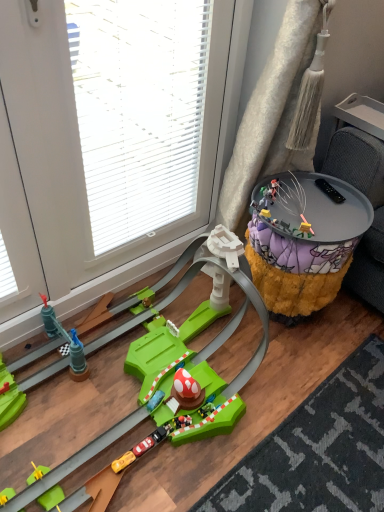
Image resolution: width=384 pixels, height=512 pixels. What are the coordinates of `vacant space in front of shaggy yellow ottoman at right` in the screenshot? It's located at (327, 379).